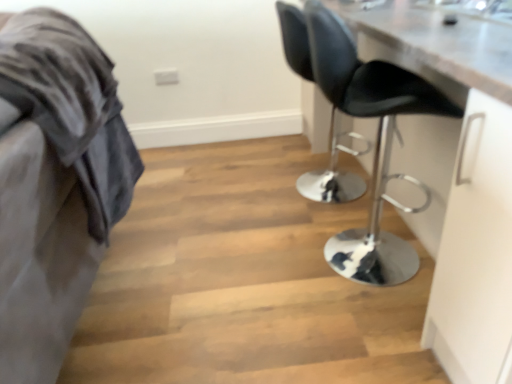
Identify the location of velvet grey blanket at left. (54, 184).

Image resolution: width=512 pixels, height=384 pixels. Describe the element at coordinates (54, 184) in the screenshot. I see `velvet grey blanket at left` at that location.

The width and height of the screenshot is (512, 384). Find the location of `black leather chair at center, the first chair when ordered from back to front`. black leather chair at center, the first chair when ordered from back to front is located at coordinates (330, 185).

Does point (334, 93) come farther from viewer compared to point (320, 188)?

No, it is in front of (320, 188).

Can you confirm if black leather chair at right, which appears as the 2th chair when viewed from the back, is taller than black leather chair at center, the first chair when ordered from back to front?

Indeed, black leather chair at right, which appears as the 2th chair when viewed from the back, has a greater height compared to black leather chair at center, the first chair when ordered from back to front.

Which is more to the left, black leather chair at right, which is the 1th chair from front to back, or black leather chair at center, the first chair when ordered from back to front?

Positioned to the left is black leather chair at center, the first chair when ordered from back to front.

Considering the positions of objects black leather chair at right, which is the 1th chair from front to back, and black leather chair at center, which ranks as the 2th chair in front-to-back order, in the image provided, who is in front, black leather chair at right, which is the 1th chair from front to back, or black leather chair at center, which ranks as the 2th chair in front-to-back order,?

Positioned in front is black leather chair at right, which is the 1th chair from front to back.

Could you tell me if black leather chair at center, the first chair when ordered from back to front, is turned towards velvet grey blanket at left?

No, black leather chair at center, the first chair when ordered from back to front, does not turn towards velvet grey blanket at left.

Which of these two, black leather chair at center, which ranks as the 2th chair in front-to-back order, or velvet grey blanket at left, stands shorter?

black leather chair at center, which ranks as the 2th chair in front-to-back order.

Which is behind, point (303, 174) or point (4, 374)?

The point (303, 174) is farther.

Choose the correct answer: Is black leather chair at right, which appears as the 2th chair when viewed from the back, inside velvet grey blanket at left or outside it?

black leather chair at right, which appears as the 2th chair when viewed from the back, exists outside the volume of velvet grey blanket at left.

From the picture: Visually, is black leather chair at right, which appears as the 2th chair when viewed from the back, positioned to the left or to the right of velvet grey blanket at left?

Clearly, black leather chair at right, which appears as the 2th chair when viewed from the back, is on the right of velvet grey blanket at left in the image.

From a real-world perspective, is black leather chair at right, which is the 1th chair from front to back, below velvet grey blanket at left?

No, from a real-world perspective, black leather chair at right, which is the 1th chair from front to back, is not beneath velvet grey blanket at left.

From a real-world perspective, is black leather chair at center, the first chair when ordered from back to front, on black leather chair at right, which appears as the 2th chair when viewed from the back?

No, from a real-world perspective, black leather chair at center, the first chair when ordered from back to front, is not on top of black leather chair at right, which appears as the 2th chair when viewed from the back.

Consider the image. How different are the orientations of black leather chair at center, which ranks as the 2th chair in front-to-back order, and black leather chair at right, which is the 1th chair from front to back, in degrees?

There is a 5.04e-05-degree angle between the facing directions of black leather chair at center, which ranks as the 2th chair in front-to-back order, and black leather chair at right, which is the 1th chair from front to back.

From the picture: From the image's perspective, is black leather chair at center, the first chair when ordered from back to front, below black leather chair at right, which is the 1th chair from front to back?

Actually, black leather chair at center, the first chair when ordered from back to front, appears above black leather chair at right, which is the 1th chair from front to back, in the image.

Considering the relative sizes of black leather chair at center, which ranks as the 2th chair in front-to-back order, and black leather chair at right, which appears as the 2th chair when viewed from the back, in the image provided, is black leather chair at center, which ranks as the 2th chair in front-to-back order, thinner than black leather chair at right, which appears as the 2th chair when viewed from the back,?

Yes, black leather chair at center, which ranks as the 2th chair in front-to-back order, is thinner than black leather chair at right, which appears as the 2th chair when viewed from the back.

Is velvet grey blanket at left not close to black leather chair at center, which ranks as the 2th chair in front-to-back order?

Yes, velvet grey blanket at left is far from black leather chair at center, which ranks as the 2th chair in front-to-back order.

How many degrees apart are the facing directions of velvet grey blanket at left and black leather chair at center, the first chair when ordered from back to front?

They differ by 90 degrees in their facing directions.

Would you say black leather chair at center, which ranks as the 2th chair in front-to-back order, is part of velvet grey blanket at left's contents?

Actually, black leather chair at center, which ranks as the 2th chair in front-to-back order, is outside velvet grey blanket at left.

Which object is positioned more to the right, velvet grey blanket at left or black leather chair at center, which ranks as the 2th chair in front-to-back order?

Positioned to the right is black leather chair at center, which ranks as the 2th chair in front-to-back order.

Considering the sizes of velvet grey blanket at left and black leather chair at right, which appears as the 2th chair when viewed from the back, in the image, is velvet grey blanket at left wider or thinner than black leather chair at right, which appears as the 2th chair when viewed from the back,?

velvet grey blanket at left is wider than black leather chair at right, which appears as the 2th chair when viewed from the back.

Where is `furniture located below the black leather chair at right, which appears as the 2th chair when viewed from the back (from the image's perspective)`? furniture located below the black leather chair at right, which appears as the 2th chair when viewed from the back (from the image's perspective) is located at coordinates (54, 184).

Is velvet grey blanket at left turned away from black leather chair at right, which appears as the 2th chair when viewed from the back?

No, velvet grey blanket at left is not facing the opposite direction of black leather chair at right, which appears as the 2th chair when viewed from the back.

How far apart are velvet grey blanket at left and black leather chair at right, which is the 1th chair from front to back?

velvet grey blanket at left and black leather chair at right, which is the 1th chair from front to back, are 33.29 inches apart.

This screenshot has height=384, width=512. I want to click on chair lying above the black leather chair at right, which appears as the 2th chair when viewed from the back (from the image's perspective), so click(x=330, y=185).

This screenshot has height=384, width=512. What are the coordinates of `the 1st chair to the right of the velvet grey blanket at left, starting your count from the anchor` in the screenshot? It's located at (330, 185).

Looking at the image, which one is located further to black leather chair at right, which appears as the 2th chair when viewed from the back, black leather chair at center, the first chair when ordered from back to front, or velvet grey blanket at left?

black leather chair at center, the first chair when ordered from back to front, lies further to black leather chair at right, which appears as the 2th chair when viewed from the back, than the other object.

Based on their spatial positions, is black leather chair at right, which appears as the 2th chair when viewed from the back, or velvet grey blanket at left further from black leather chair at center, the first chair when ordered from back to front?

Based on the image, velvet grey blanket at left appears to be further to black leather chair at center, the first chair when ordered from back to front.

Estimate the real-world distances between objects in this image. Which object is closer to black leather chair at right, which appears as the 2th chair when viewed from the back, velvet grey blanket at left or black leather chair at center, which ranks as the 2th chair in front-to-back order?

Among the two, velvet grey blanket at left is located nearer to black leather chair at right, which appears as the 2th chair when viewed from the back.

Which object lies further to the anchor point velvet grey blanket at left, black leather chair at right, which appears as the 2th chair when viewed from the back, or black leather chair at center, the first chair when ordered from back to front?

black leather chair at center, the first chair when ordered from back to front.

From the image, which object appears to be nearer to velvet grey blanket at left, black leather chair at center, the first chair when ordered from back to front, or black leather chair at right, which is the 1th chair from front to back?

black leather chair at right, which is the 1th chair from front to back, lies closer to velvet grey blanket at left than the other object.

From the image, which object appears to be farther from black leather chair at center, the first chair when ordered from back to front, velvet grey blanket at left or black leather chair at right, which appears as the 2th chair when viewed from the back?

Based on the image, velvet grey blanket at left appears to be further to black leather chair at center, the first chair when ordered from back to front.

Identify the location of chair situated between velvet grey blanket at left and black leather chair at right, which appears as the 2th chair when viewed from the back, from left to right. (330, 185).